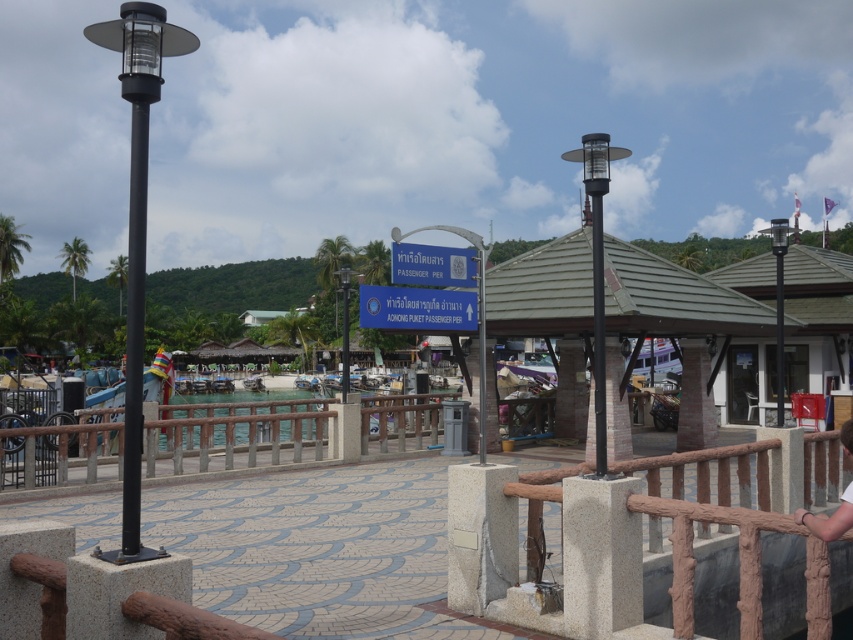
Looking at this image, you are a painter who wants to paint both the brown textured rail at center and the rustic wood rail at lower center. You have a limited amount of paint. Which rail requires less paint because of its smaller width?

The brown textured rail at center requires less paint because its width is less than the rustic wood rail at lower center.